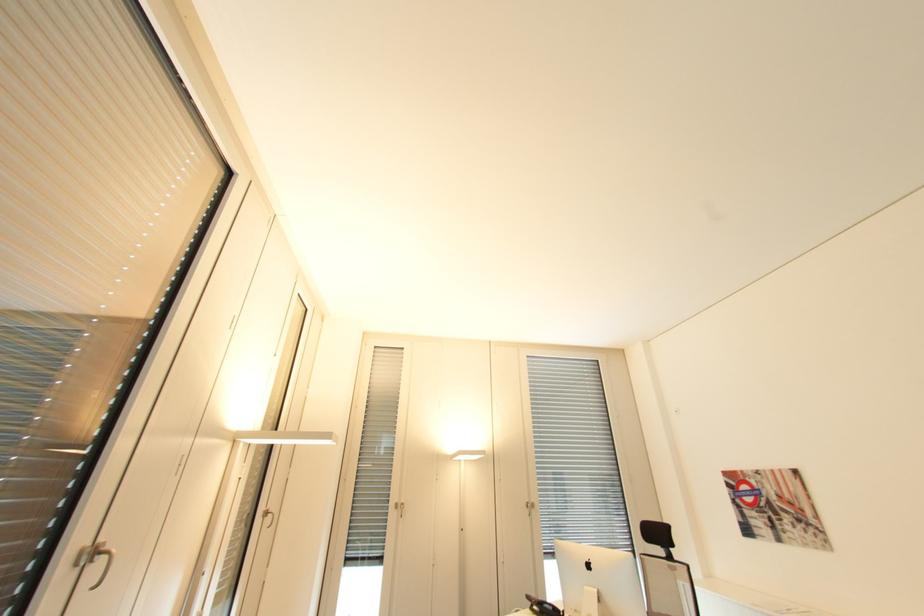
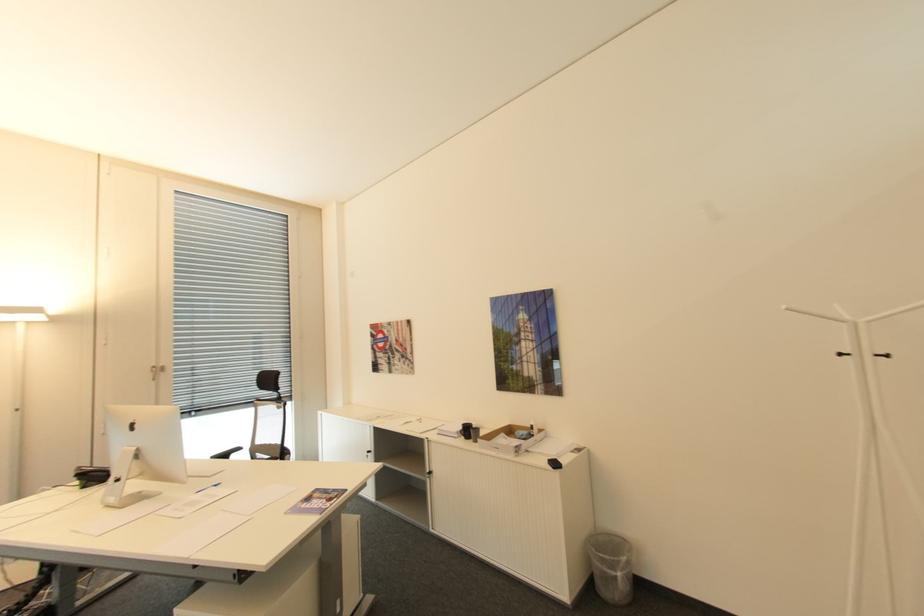
Find the pixel in the second image that matches (596,565) in the first image.

(140, 426)